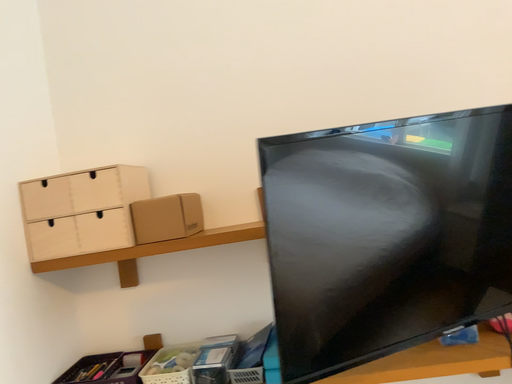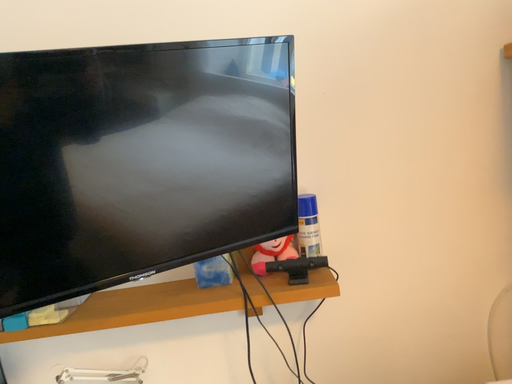
Question: Which way did the camera rotate in the video?

Choices:
 (A) rotated left
 (B) rotated right

Answer: (B)